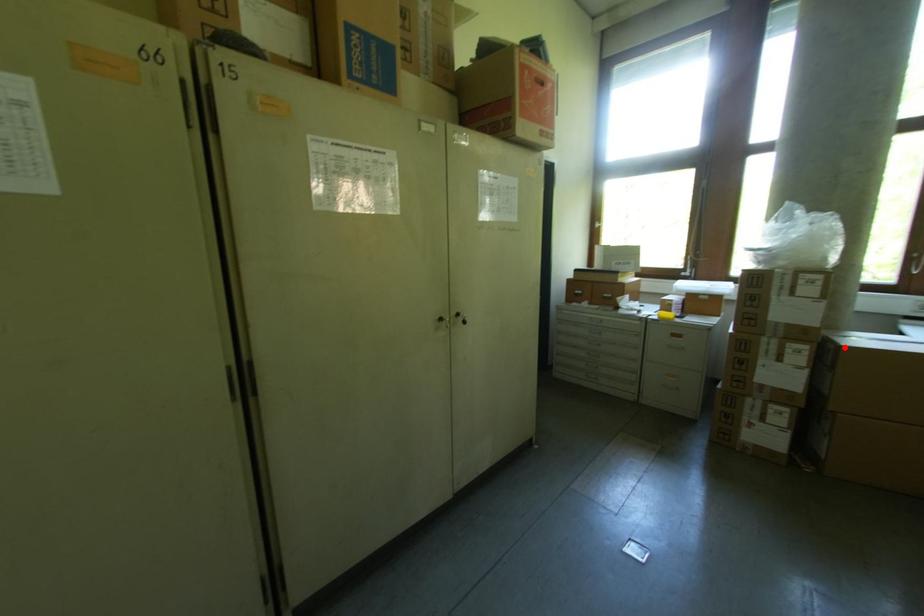
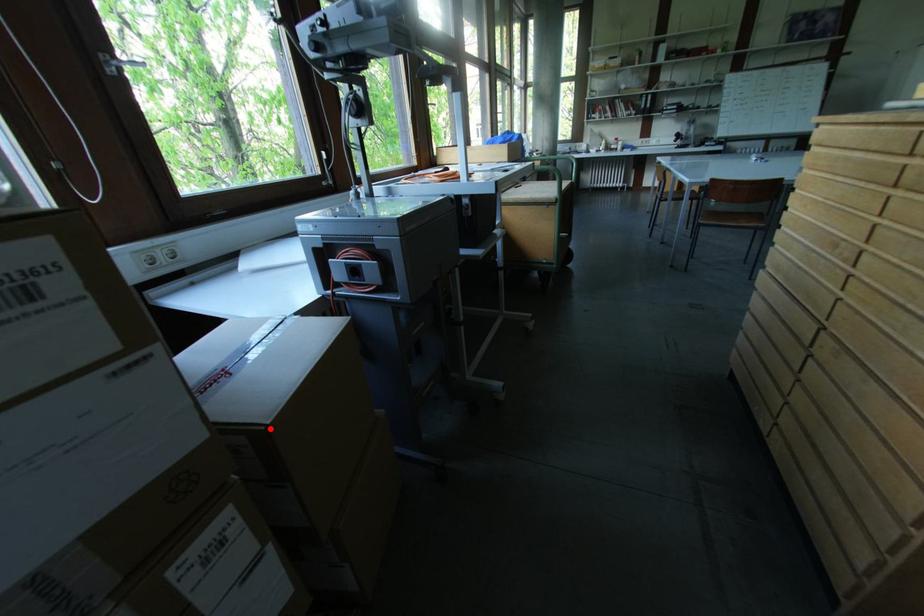
I am providing you with two images of the same scene from different viewpoints. A red point is marked on the first image and another point is marked on the second image. Do the highlighted points in image1 and image2 indicate the same real-world spot?

Yes